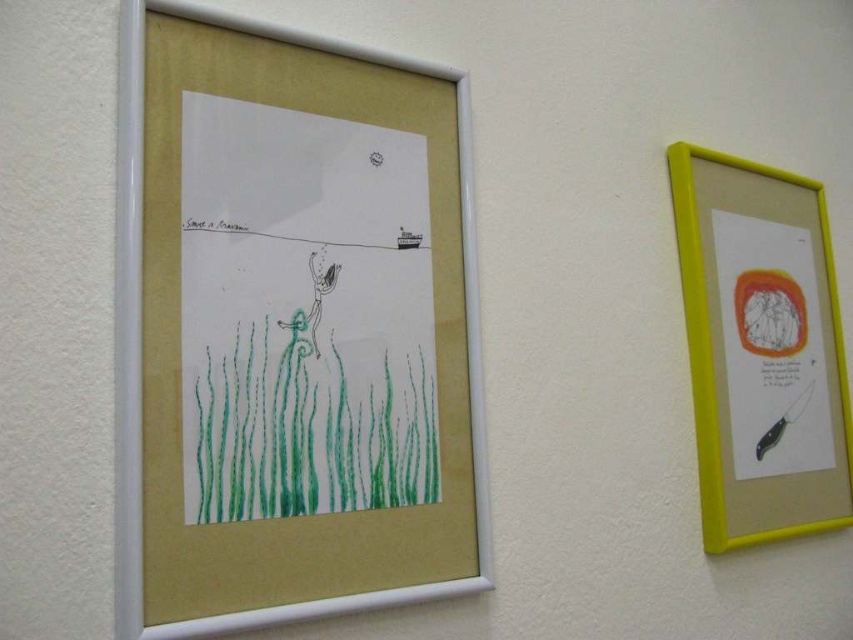
You are an interior designer arranging furniture in a room with this wall. You need to place a sofa that is 1.8 meters wide. The sofa will be positioned in front of the wall where the white matte picture frame at left and green crayon grass at lower left are hanging. Considering the size of the artwork, will the sofa fit comfortably between them?

The white matte picture frame at left is larger in size than the green crayon grass at lower left. Since the sofa is 1.8 meters wide, and the distance between the two artworks isn

From the picture: You are an interior designer arranging a living room with a 40 inch wide wall space. You have a yellow plastic picture frame at right and green crayon grass at lower left. Can both items fit side by side on the wall without overlapping?

The yellow plastic picture frame at right is 23.62 inches away from green crayon grass at lower left. Since the total distance between them is 23.62 inches and the wall space is 40 inches wide, there is enough space to fit both items side by side without overlapping.

From the picture: You are hanging a new yellow plastic picture frame at right in a room with existing green crayon grass at lower left. Will the frame block the view of the grass?

The yellow plastic picture frame at right is positioned over green crayon grass at lower left, so the frame will block the view of the grass.